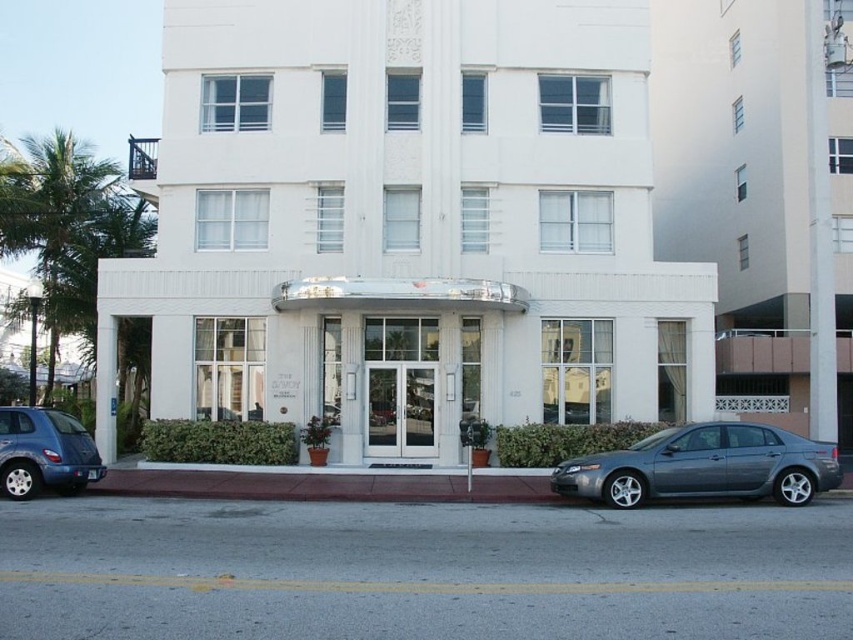
You are a delivery person trying to park your 3.5 meter long van in front of the white smooth building at right. The red brick sidewalk at center is the only available parking spot. Considering the size of the sidewalk, can your van fit there?

The white smooth building at right is bigger than the red brick sidewalk at center, so the van may not fit comfortably in the parking spot on the red brick sidewalk at center due to its smaller size compared to the building.

You are a delivery person trying to park your 1.2 meter wide delivery van. You see the white smooth building at right and the red brick sidewalk at center. Which area can accommodate your van?

The red brick sidewalk at center can accommodate your van since it is wider than the white smooth building at right, which is thinner and not suitable for parking.

From the picture: You are standing in front of the white smooth building at center and want to take a photo of the matte blue suv at lower left. Which object should you focus on first if you want to capture both in the frame without moving the camera?

You should focus on the white smooth building at center first because it is taller than the matte blue suv at lower left, so it will require adjusting the camera angle to include its full height while still capturing the suv in the foreground.